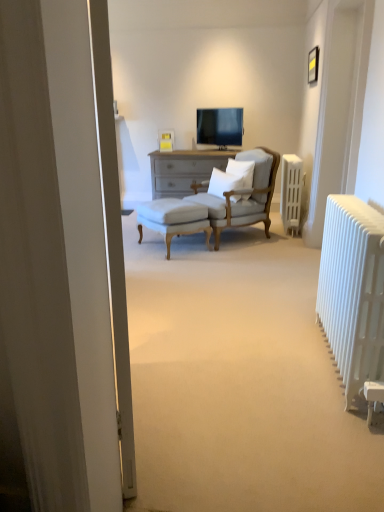
What is the approximate height of white upholstered stool at center?

It is 49.22 centimeters.

The width and height of the screenshot is (384, 512). Describe the element at coordinates (242, 170) in the screenshot. I see `white soft pillow at center, the second pillow viewed from the left` at that location.

Describe the element at coordinates (220, 126) in the screenshot. I see `matte black tv at center` at that location.

Where is `white soft cushion at center, which ranks as the first pillow in left-to-right order`? white soft cushion at center, which ranks as the first pillow in left-to-right order is located at coordinates (223, 182).

Considering the positions of objects white metallic radiator at right, the 1th radiator viewed from the front, and matte black tv at center in the image provided, who is more to the left, white metallic radiator at right, the 1th radiator viewed from the front, or matte black tv at center?

From the viewer's perspective, matte black tv at center appears more on the left side.

From a real-world perspective, is white metallic radiator at right, acting as the second radiator starting from the top, below matte black tv at center?

Yes, from a real-world perspective, white metallic radiator at right, acting as the second radiator starting from the top, is beneath matte black tv at center.

Based on the photo, which object is closer to the camera taking this photo, white metallic radiator at right, the first radiator positioned from the bottom, or matte black tv at center?

white metallic radiator at right, the first radiator positioned from the bottom, is more forward.

Looking at this image, from the image's perspective, between white metallic radiator at right, the first radiator positioned from the bottom, and matte black tv at center, which one is located above?

matte black tv at center is shown above in the image.

Is white soft cushion at center, which appears as the second pillow when viewed from the right, turned away from white upholstered stool at center?

white soft cushion at center, which appears as the second pillow when viewed from the right, does not have its back to white upholstered stool at center.

Is white soft cushion at center, which ranks as the first pillow in left-to-right order, taller or shorter than white upholstered stool at center?

Considering their sizes, white soft cushion at center, which ranks as the first pillow in left-to-right order, has less height than white upholstered stool at center.

The height and width of the screenshot is (512, 384). In order to click on stool lying below the white soft cushion at center, which appears as the second pillow when viewed from the right (from the image's perspective) in this screenshot , I will do `click(174, 219)`.

Does white soft cushion at center, which appears as the second pillow when viewed from the right, have a smaller size compared to white upholstered stool at center?

Yes.

Who is smaller, white plastic radiator at right, the first radiator positioned from the back, or white soft cushion at center, which appears as the second pillow when viewed from the right?

white soft cushion at center, which appears as the second pillow when viewed from the right, is smaller.

Could you tell me if white plastic radiator at right, which is counted as the 2th radiator, starting from the front, is facing white soft cushion at center, which ranks as the first pillow in left-to-right order?

Yes, white plastic radiator at right, which is counted as the 2th radiator, starting from the front, is facing white soft cushion at center, which ranks as the first pillow in left-to-right order.

Which point is more forward, (288, 162) or (230, 188)?

The point (230, 188) is in front.

Considering the relative sizes of white plastic radiator at right, placed as the 1th radiator when sorted from right to left, and white soft cushion at center, which ranks as the first pillow in left-to-right order, in the image provided, is white plastic radiator at right, placed as the 1th radiator when sorted from right to left, wider than white soft cushion at center, which ranks as the first pillow in left-to-right order,?

In fact, white plastic radiator at right, placed as the 1th radiator when sorted from right to left, might be narrower than white soft cushion at center, which ranks as the first pillow in left-to-right order.

Between white upholstered stool at center and matte black tv at center, which one has larger width?

Wider between the two is white upholstered stool at center.

Is matte black tv at center at the back of white upholstered stool at center?

No, white upholstered stool at center is not facing the opposite direction of matte black tv at center.

From the image's perspective, is white upholstered stool at center located above or below matte black tv at center?

From the image's perspective, white upholstered stool at center appears below matte black tv at center.

In the scene shown: Considering the sizes of objects white plastic radiator at right, placed as the 1th radiator when sorted from right to left, and light beige fabric armchair at center in the image provided, who is shorter, white plastic radiator at right, placed as the 1th radiator when sorted from right to left, or light beige fabric armchair at center?

white plastic radiator at right, placed as the 1th radiator when sorted from right to left, is shorter.

Is white plastic radiator at right, which is counted as the 2th radiator, starting from the front, at the right side of light beige fabric armchair at center?

Yes.

Measure the distance from white plastic radiator at right, which is counted as the 2th radiator, starting from the front, to light beige fabric armchair at center.

white plastic radiator at right, which is counted as the 2th radiator, starting from the front, is 14.79 inches from light beige fabric armchair at center.

What's the angular difference between white plastic radiator at right, placed as the 1th radiator when sorted from right to left, and light beige fabric armchair at center's facing directions?

white plastic radiator at right, placed as the 1th radiator when sorted from right to left, and light beige fabric armchair at center are facing 34.9 degrees away from each other.

At what (x,y) coordinates should I click in order to perform the action: click on chair that appears below the white soft cushion at center, which appears as the second pillow when viewed from the right (from a real-world perspective). Please return your answer as a coordinate pair (x, y). This screenshot has height=512, width=384. Looking at the image, I should click on (244, 200).

Would you say light beige fabric armchair at center is outside white soft cushion at center, which ranks as the first pillow in left-to-right order?

light beige fabric armchair at center is positioned outside white soft cushion at center, which ranks as the first pillow in left-to-right order.

Consider the image. Is light beige fabric armchair at center oriented towards white soft cushion at center, which appears as the second pillow when viewed from the right?

Yes, light beige fabric armchair at center is turned towards white soft cushion at center, which appears as the second pillow when viewed from the right.

From the image's perspective, is light beige fabric armchair at center positioned above or below white soft cushion at center, which ranks as the first pillow in left-to-right order?

light beige fabric armchair at center is situated lower than white soft cushion at center, which ranks as the first pillow in left-to-right order, in the image.

Is white soft cushion at center, which appears as the second pillow when viewed from the right, oriented towards light beige fabric armchair at center?

Yes, white soft cushion at center, which appears as the second pillow when viewed from the right, is aimed at light beige fabric armchair at center.

Between point (220, 173) and point (260, 169), which one is positioned in front?

The point (260, 169) is closer.

Considering the sizes of objects white soft cushion at center, which appears as the second pillow when viewed from the right, and light beige fabric armchair at center in the image provided, who is bigger, white soft cushion at center, which appears as the second pillow when viewed from the right, or light beige fabric armchair at center?

Bigger between the two is light beige fabric armchair at center.

From the image's perspective, is white soft cushion at center, which ranks as the first pillow in left-to-right order, positioned above or below light beige fabric armchair at center?

Based on their image positions, white soft cushion at center, which ranks as the first pillow in left-to-right order, is located above light beige fabric armchair at center.

I want to click on the 1st radiator to the right when counting from the matte black tv at center, so click(353, 290).

Identify the location of stool below the white soft cushion at center, which ranks as the first pillow in left-to-right order (from the image's perspective). (174, 219).

Which object lies further to the anchor point white upholstered stool at center, light beige fabric armchair at center or white metallic radiator at right, the first radiator positioned from the bottom?

white metallic radiator at right, the first radiator positioned from the bottom, is positioned further to the anchor white upholstered stool at center.

From the image, which object appears to be nearer to light beige fabric armchair at center, white metallic radiator at right, placed as the 1th radiator when sorted from left to right, or white upholstered stool at center?

white upholstered stool at center is closer to light beige fabric armchair at center.

From the image, which object appears to be nearer to white plastic radiator at right, which is counted as the 2th radiator, starting from the front, white soft cushion at center, which ranks as the first pillow in left-to-right order, or matte black tv at center?

white soft cushion at center, which ranks as the first pillow in left-to-right order, lies closer to white plastic radiator at right, which is counted as the 2th radiator, starting from the front, than the other object.

Based on their spatial positions, is white soft pillow at center, the second pillow viewed from the left, or white soft cushion at center, which appears as the second pillow when viewed from the right, further from light beige fabric armchair at center?

white soft cushion at center, which appears as the second pillow when viewed from the right, is further to light beige fabric armchair at center.

Which object lies nearer to the anchor point white metallic radiator at right, acting as the 2th radiator starting from the back, white plastic radiator at right, the first radiator positioned from the back, or white upholstered stool at center?

The object closer to white metallic radiator at right, acting as the 2th radiator starting from the back, is white upholstered stool at center.

From the image, which object appears to be nearer to white plastic radiator at right, positioned as the first radiator in top-to-bottom order, white soft pillow at center, which appears as the 1th pillow when viewed from the right, or white metallic radiator at right, the 1th radiator viewed from the front?

white soft pillow at center, which appears as the 1th pillow when viewed from the right, lies closer to white plastic radiator at right, positioned as the first radiator in top-to-bottom order, than the other object.

Estimate the real-world distances between objects in this image. Which object is closer to white metallic radiator at right, which is counted as the second radiator, starting from the right, white soft cushion at center, which ranks as the first pillow in left-to-right order, or white soft pillow at center, the second pillow viewed from the left?

white soft cushion at center, which ranks as the first pillow in left-to-right order, lies closer to white metallic radiator at right, which is counted as the second radiator, starting from the right, than the other object.

Based on their spatial positions, is white upholstered stool at center or white soft cushion at center, which ranks as the first pillow in left-to-right order, further from light beige fabric armchair at center?

white upholstered stool at center lies further to light beige fabric armchair at center than the other object.

This screenshot has width=384, height=512. Find the location of `pillow between light beige fabric armchair at center and white plastic radiator at right, placed as the 1th radiator when sorted from right to left`. pillow between light beige fabric armchair at center and white plastic radiator at right, placed as the 1th radiator when sorted from right to left is located at coordinates (242, 170).

Where is `radiator positioned between white metallic radiator at right, acting as the 2th radiator starting from the back, and matte black tv at center from near to far`? The image size is (384, 512). radiator positioned between white metallic radiator at right, acting as the 2th radiator starting from the back, and matte black tv at center from near to far is located at coordinates (291, 192).

The image size is (384, 512). What are the coordinates of `chair situated between white upholstered stool at center and white soft pillow at center, the second pillow viewed from the left, from left to right` in the screenshot? It's located at (244, 200).

The image size is (384, 512). Find the location of `stool positioned between white metallic radiator at right, the 1th radiator viewed from the front, and white soft pillow at center, the second pillow viewed from the left, from near to far`. stool positioned between white metallic radiator at right, the 1th radiator viewed from the front, and white soft pillow at center, the second pillow viewed from the left, from near to far is located at coordinates (174, 219).